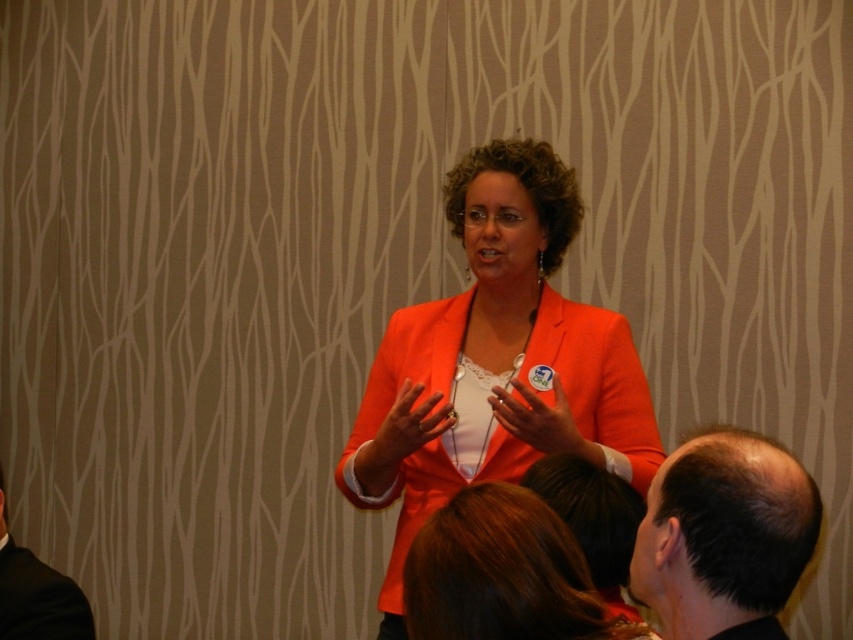
You are an event planner arranging seating for a conference. You need to place a chair between the orange matte blazer at center and the black suit at lower left. Based on their positions, which object will the chair be closer to?

The chair will be closer to the black suit at lower left because the orange matte blazer at center is further to the viewer than the black suit at lower left, so the black suit at lower left is nearer to the chair placement area.

Consider the image. You are an event planner organizing a presentation. You need to choose between the orange matte blazer at center and the black suit at lower left for the speaker. Considering their sizes, which one would be more appropriate for a speaker who prefers a bold and attention grabbing outfit?

The orange matte blazer at center is larger in size than the black suit at lower left, making it more appropriate for a speaker who prefers a bold and attention grabbing outfit since its larger size can draw more visual attention.

You are an attendee at the presentation. You notice two people in the front row with dark brown hair at lower right and shiny brown hair at lower center. Which one is closer to the speaker?

The dark brown hair at lower right is closer to the speaker because the shiny brown hair at lower center is behind it, indicating it is further back.